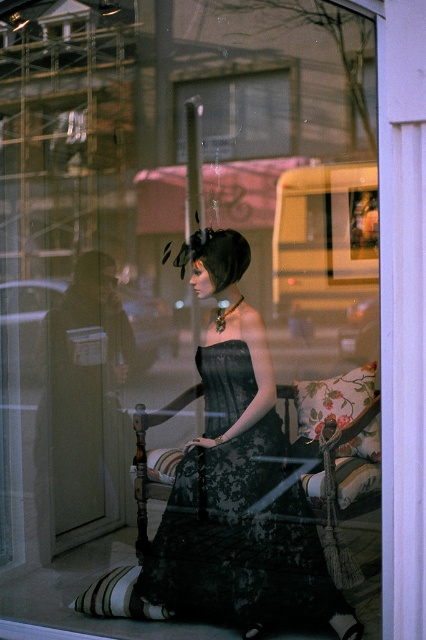
You are a customer in the shop looking at the window display. The shop assistant tells you that the dress you are interested in is located at the coordinates point (236, 541). Based on the scene description, can you identify which dress the assistant is referring to?

The point (236, 541) marks the black lace dress at center, so the assistant is referring to the black lace dress at center.

You are a customer entering the shop through the transparent glass door at center. As you walk in, where will you first encounter the black lace dress at center?

The black lace dress at center is below the transparent glass door at center, so when entering through the door, you will first see the dress positioned lower in the display area beneath the door.